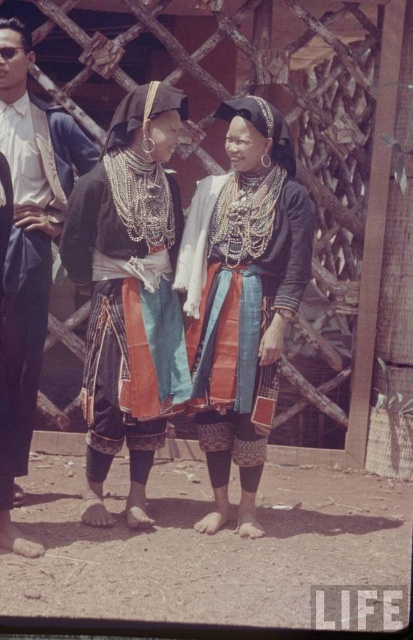
Where is `matte black dress at center`? The width and height of the screenshot is (413, 640). matte black dress at center is located at coordinates (130, 292).

How much distance is there between matte black dress at center and matte black dress at left?

They are 35.69 inches apart.

Is point (95, 232) in front of point (4, 145)?

Yes, point (95, 232) is in front of point (4, 145).

I want to click on matte black dress at center, so click(x=130, y=292).

Between textured blue skirt at center and matte black dress at left, which one is positioned lower?

matte black dress at left is lower down.

Who is more forward, (213, 252) or (61, 140)?

Point (213, 252) is more forward.

Is point (220, 481) farther from viewer compared to point (18, 333)?

Yes, point (220, 481) is farther from viewer.

Identify the location of textured blue skirt at center. This screenshot has width=413, height=640. (242, 296).

Does point (123, 381) lie in front of point (292, 289)?

No, it is behind (292, 289).

Which is in front, point (151, 164) or point (268, 173)?

Positioned in front is point (268, 173).

At what (x,y) coordinates should I click in order to perform the action: click on matte black dress at center. Please return your answer as a coordinate pair (x, y). This screenshot has width=413, height=640. Looking at the image, I should click on (130, 292).